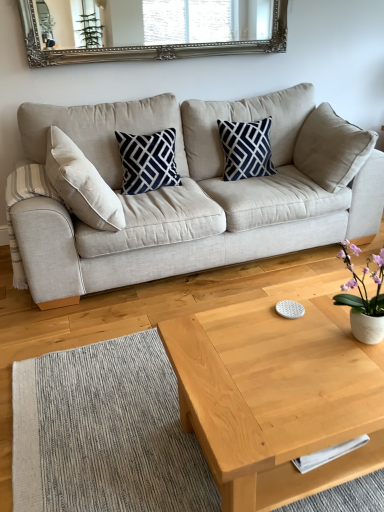
From the picture: What is the approximate height of light wood/texture coffee table at center?

light wood/texture coffee table at center is 45.15 centimeters in height.

I want to click on light wood/texture coffee table at center, so click(276, 396).

Based on the photo, in order to face silver/gilded mirror at upper center, should I rotate leftwards or rightwards?

Turn left by 3.441 degrees to look at silver/gilded mirror at upper center.

Describe the element at coordinates (246, 149) in the screenshot. This screenshot has height=512, width=384. I see `navy blue printed cushion at center, the 2th pillow positioned from the left` at that location.

This screenshot has height=512, width=384. What do you see at coordinates (363, 297) in the screenshot?
I see `white ceramic vase at right` at bounding box center [363, 297].

This screenshot has width=384, height=512. Describe the element at coordinates (148, 161) in the screenshot. I see `navy blue/white geometric pillow at center, which is the second pillow in right-to-left order` at that location.

At what (x,y) coordinates should I click in order to perform the action: click on light wood/texture coffee table at center. Please return your answer as a coordinate pair (x, y). The width and height of the screenshot is (384, 512). Looking at the image, I should click on (276, 396).

From the image's perspective, would you say navy blue/white geometric pillow at center, which is the second pillow in right-to-left order, is positioned over white ceramic vase at right?

Yes, from the image's perspective, navy blue/white geometric pillow at center, which is the second pillow in right-to-left order, is over white ceramic vase at right.

Is navy blue/white geometric pillow at center, arranged as the 1th pillow when viewed from the left, facing towards white ceramic vase at right?

Yes, navy blue/white geometric pillow at center, arranged as the 1th pillow when viewed from the left, faces towards white ceramic vase at right.

Is navy blue/white geometric pillow at center, which is the second pillow in right-to-left order, thinner than white ceramic vase at right?

No.

Between silver/gilded mirror at upper center and navy blue/white geometric pillow at center, which is the second pillow in right-to-left order, which one has larger size?

Bigger between the two is silver/gilded mirror at upper center.

Which of these two, silver/gilded mirror at upper center or navy blue/white geometric pillow at center, arranged as the 1th pillow when viewed from the left, stands shorter?

With less height is silver/gilded mirror at upper center.

Is silver/gilded mirror at upper center in front of or behind navy blue/white geometric pillow at center, arranged as the 1th pillow when viewed from the left, in the image?

In the image, silver/gilded mirror at upper center appears behind navy blue/white geometric pillow at center, arranged as the 1th pillow when viewed from the left.

At what (x,y) coordinates should I click in order to perform the action: click on pillow that is the 2nd one when counting downward from the silver/gilded mirror at upper center (from the image's perspective). Please return your answer as a coordinate pair (x, y). Looking at the image, I should click on (148, 161).

Considering the relative positions of light wood/texture coffee table at center and navy blue/white geometric pillow at center, arranged as the 1th pillow when viewed from the left, in the image provided, is light wood/texture coffee table at center to the left or to the right of navy blue/white geometric pillow at center, arranged as the 1th pillow when viewed from the left,?

Based on their positions, light wood/texture coffee table at center is located to the right of navy blue/white geometric pillow at center, arranged as the 1th pillow when viewed from the left.

Looking at this image, is light wood/texture coffee table at center positioned beyond the bounds of navy blue/white geometric pillow at center, which is the second pillow in right-to-left order?

light wood/texture coffee table at center lies outside navy blue/white geometric pillow at center, which is the second pillow in right-to-left order,'s area.

Is light wood/texture coffee table at center facing away from navy blue/white geometric pillow at center, arranged as the 1th pillow when viewed from the left?

That's right, light wood/texture coffee table at center is facing away from navy blue/white geometric pillow at center, arranged as the 1th pillow when viewed from the left.

Does light wood/texture coffee table at center have a larger size compared to navy blue/white geometric pillow at center, arranged as the 1th pillow when viewed from the left?

Indeed, light wood/texture coffee table at center has a larger size compared to navy blue/white geometric pillow at center, arranged as the 1th pillow when viewed from the left.

Who is more distant, beige fabric couch at center or white ceramic vase at right?

beige fabric couch at center.

From a real-world perspective, which object rests below the other?

In real-world perspective, beige fabric couch at center is lower.

Which point is more distant from viewer, (284,238) or (355,328)?

The point (284,238) is behind.

Is beige fabric couch at center positioned with its back to white ceramic vase at right?

No, white ceramic vase at right is not at the back of beige fabric couch at center.

From a real-world perspective, is navy blue printed cushion at center, the 2th pillow positioned from the left, located higher than beige fabric couch at center?

Indeed, from a real-world perspective, navy blue printed cushion at center, the 2th pillow positioned from the left, stands above beige fabric couch at center.

From the image's perspective, between navy blue printed cushion at center, the 2th pillow positioned from the left, and beige fabric couch at center, who is located below?

beige fabric couch at center, from the image's perspective.

Does point (256, 126) come in front of point (182, 226)?

No, it is behind (182, 226).

Is silver/gilded mirror at upper center positioned before navy blue printed cushion at center, the 2th pillow positioned from the left?

Yes.

Is silver/gilded mirror at upper center wider than navy blue printed cushion at center, the first pillow from the right?

No, silver/gilded mirror at upper center is not wider than navy blue printed cushion at center, the first pillow from the right.

Is navy blue printed cushion at center, the 2th pillow positioned from the left, at the back of silver/gilded mirror at upper center?

No, silver/gilded mirror at upper center is not facing the opposite direction of navy blue printed cushion at center, the 2th pillow positioned from the left.

From the picture: Does navy blue/white geometric pillow at center, arranged as the 1th pillow when viewed from the left, turn towards light wood/texture coffee table at center?

Yes, navy blue/white geometric pillow at center, arranged as the 1th pillow when viewed from the left, faces towards light wood/texture coffee table at center.

Is navy blue/white geometric pillow at center, arranged as the 1th pillow when viewed from the left, to the left of light wood/texture coffee table at center from the viewer's perspective?

Correct, you'll find navy blue/white geometric pillow at center, arranged as the 1th pillow when viewed from the left, to the left of light wood/texture coffee table at center.

Based on their sizes in the image, would you say navy blue/white geometric pillow at center, arranged as the 1th pillow when viewed from the left, is bigger or smaller than light wood/texture coffee table at center?

In the image, navy blue/white geometric pillow at center, arranged as the 1th pillow when viewed from the left, appears to be smaller than light wood/texture coffee table at center.

The width and height of the screenshot is (384, 512). I want to click on the 2nd pillow counting from the left of the white ceramic vase at right, so click(148, 161).

In order to click on pillow that appears in front of the silver/gilded mirror at upper center in this screenshot , I will do `click(148, 161)`.

When comparing their distances from navy blue/white geometric pillow at center, arranged as the 1th pillow when viewed from the left, does white ceramic vase at right or beige fabric couch at center seem closer?

beige fabric couch at center lies closer to navy blue/white geometric pillow at center, arranged as the 1th pillow when viewed from the left, than the other object.

When comparing their distances from white ceramic vase at right, does navy blue/white geometric pillow at center, which is the second pillow in right-to-left order, or silver/gilded mirror at upper center seem further?

The object further to white ceramic vase at right is silver/gilded mirror at upper center.

When comparing their distances from beige fabric couch at center, does navy blue printed cushion at center, the 2th pillow positioned from the left, or silver/gilded mirror at upper center seem further?

silver/gilded mirror at upper center is positioned further to the anchor beige fabric couch at center.

Based on their spatial positions, is navy blue/white geometric pillow at center, which is the second pillow in right-to-left order, or silver/gilded mirror at upper center closer to beige fabric couch at center?

navy blue/white geometric pillow at center, which is the second pillow in right-to-left order, lies closer to beige fabric couch at center than the other object.

From the image, which object appears to be nearer to silver/gilded mirror at upper center, beige fabric couch at center or navy blue/white geometric pillow at center, arranged as the 1th pillow when viewed from the left?

navy blue/white geometric pillow at center, arranged as the 1th pillow when viewed from the left.

Based on their spatial positions, is navy blue printed cushion at center, the 2th pillow positioned from the left, or silver/gilded mirror at upper center further from navy blue/white geometric pillow at center, which is the second pillow in right-to-left order?

silver/gilded mirror at upper center.

When comparing their distances from white ceramic vase at right, does light wood/texture coffee table at center or navy blue/white geometric pillow at center, which is the second pillow in right-to-left order, seem closer?

light wood/texture coffee table at center.

From the image, which object appears to be farther from beige fabric couch at center, navy blue/white geometric pillow at center, which is the second pillow in right-to-left order, or white ceramic vase at right?

white ceramic vase at right is further to beige fabric couch at center.

Locate an element on the screen. The image size is (384, 512). pillow between white ceramic vase at right and navy blue printed cushion at center, the first pillow from the right, along the z-axis is located at coordinates (148, 161).

You are a GUI agent. You are given a task and a screenshot of the screen. Output one action in this format:
    pyautogui.click(x=<x>, y=<y>)
    Task: Click on the studio couch that lies between silver/gilded mirror at upper center and light wood/texture coffee table at center from top to bottom
    Image resolution: width=384 pixels, height=512 pixels.
    Given the screenshot: What is the action you would take?
    pyautogui.click(x=193, y=194)

The image size is (384, 512). Identify the location of pillow between light wood/texture coffee table at center and navy blue printed cushion at center, the 2th pillow positioned from the left, along the z-axis. (148, 161).

Locate an element on the screen. The width and height of the screenshot is (384, 512). pillow positioned between beige fabric couch at center and navy blue printed cushion at center, the first pillow from the right, from near to far is located at coordinates (148, 161).